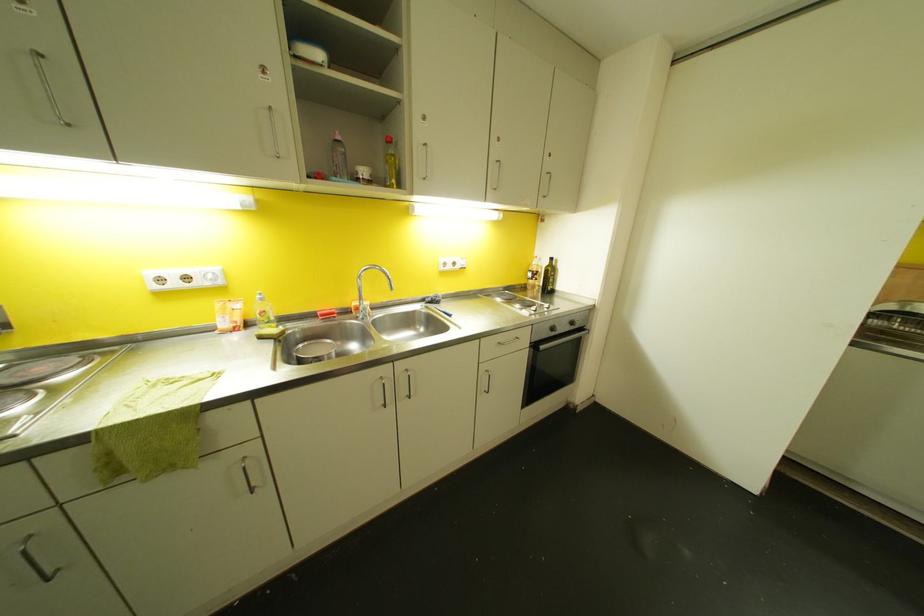
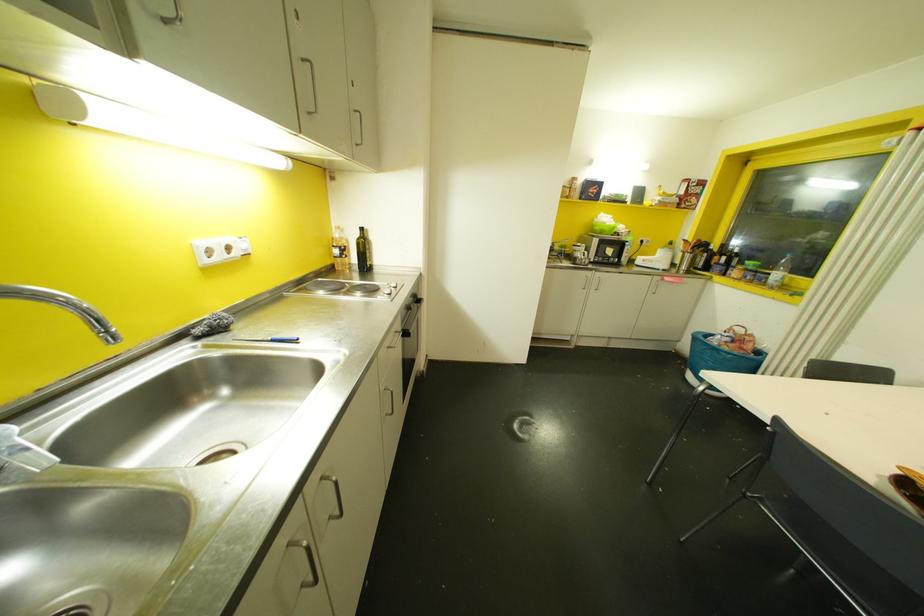
Question: The camera is either moving clockwise (left) or counter-clockwise (right) around the object. The first image is from the beginning of the video and the second image is from the end. Is the camera moving left or right when shooting the video?

Choices:
 (A) Left
 (B) Right

Answer: (A)